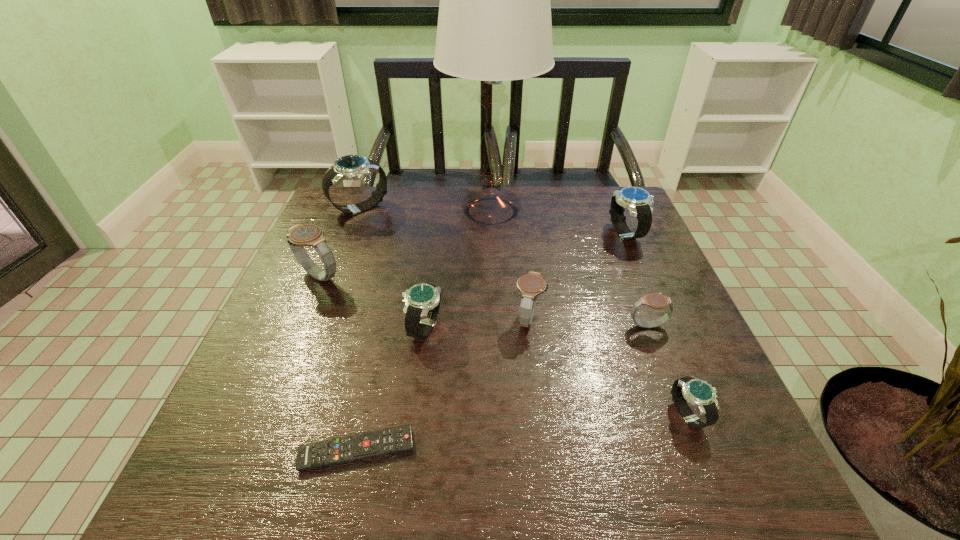
Image resolution: width=960 pixels, height=540 pixels. I want to click on the tallest object, so click(x=494, y=24).

I want to click on the biggest silver watch, so click(350, 167).

Identify the location of the fourth farthest object. (311, 235).

Identify the location of the leftmost gray watch. The height and width of the screenshot is (540, 960). (311, 235).

I want to click on the second biggest silver watch, so click(x=639, y=202).

Where is `the second biggest gray watch`? the second biggest gray watch is located at coordinates (531, 285).

Where is `the fourth watch from left to right`? Image resolution: width=960 pixels, height=540 pixels. the fourth watch from left to right is located at coordinates (531, 285).

Where is `the second nearest silver watch`? The height and width of the screenshot is (540, 960). the second nearest silver watch is located at coordinates (422, 301).

This screenshot has height=540, width=960. Identify the location of the third watch from left to right. (422, 301).

This screenshot has width=960, height=540. I want to click on the smallest gray watch, so click(655, 300).